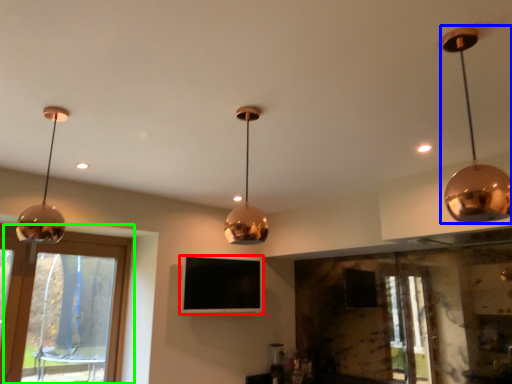
Question: Estimate the real-world distances between objects in this image. Which object is farther from television (highlighted by a red box), lamp (highlighted by a blue box) or window (highlighted by a green box)?

Choices:
 (A) lamp
 (B) window

Answer: (A)